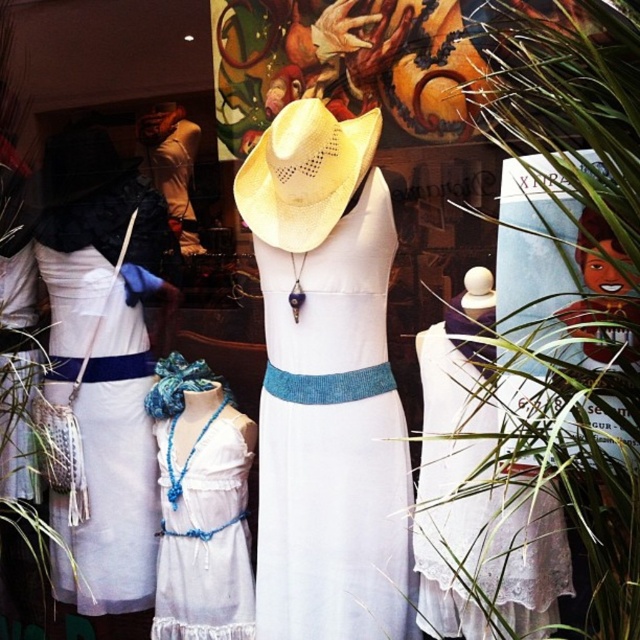
Can you confirm if white knitted dress at center is shorter than white woven fabric dress at left?

Incorrect, white knitted dress at center's height does not fall short of white woven fabric dress at left's.

Can you confirm if white knitted dress at center is smaller than white woven fabric dress at left?

No, white knitted dress at center is not smaller than white woven fabric dress at left.

The image size is (640, 640). Describe the element at coordinates (333, 440) in the screenshot. I see `white knitted dress at center` at that location.

Identify the location of white knitted dress at center. (333, 440).

Between green leafy plant at center and white crochet dress at center, which one appears on the left side from the viewer's perspective?

From the viewer's perspective, white crochet dress at center appears more on the left side.

Consider the image. Can you confirm if green leafy plant at center is positioned below white crochet dress at center?

No, green leafy plant at center is not below white crochet dress at center.

Does point (589, 179) come farther from viewer compared to point (225, 518)?

No, it is not.

The height and width of the screenshot is (640, 640). What are the coordinates of `green leafy plant at center` in the screenshot? It's located at (557, 326).

Is green leafy plant at center bigger than white lace dress at center?

Correct, green leafy plant at center is larger in size than white lace dress at center.

Can you confirm if green leafy plant at center is shorter than white lace dress at center?

In fact, green leafy plant at center may be taller than white lace dress at center.

Where is `green leafy plant at center`? green leafy plant at center is located at coordinates (557, 326).

In order to click on green leafy plant at center in this screenshot , I will do `click(557, 326)`.